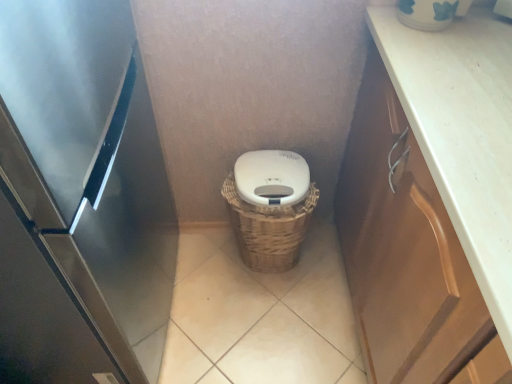
Question: Is stainless steel refrigerator at left situated inside beige tile at center or outside?

Choices:
 (A) inside
 (B) outside

Answer: (B)

Question: Considering the relative positions of stainless steel refrigerator at left and beige tile at center in the image provided, is stainless steel refrigerator at left to the left or to the right of beige tile at center?

Choices:
 (A) left
 (B) right

Answer: (A)

Question: Estimate the real-world distances between objects in this image. Which object is farther from the white matte lid at center?

Choices:
 (A) beige tile at center
 (B) stainless steel refrigerator at left
 (C) brown wood cabinet at right
 (D) woven brown basket at center

Answer: (B)

Question: Which is nearer to the white matte lid at center?

Choices:
 (A) stainless steel refrigerator at left
 (B) brown wood cabinet at right
 (C) woven brown basket at center
 (D) beige tile at center

Answer: (C)